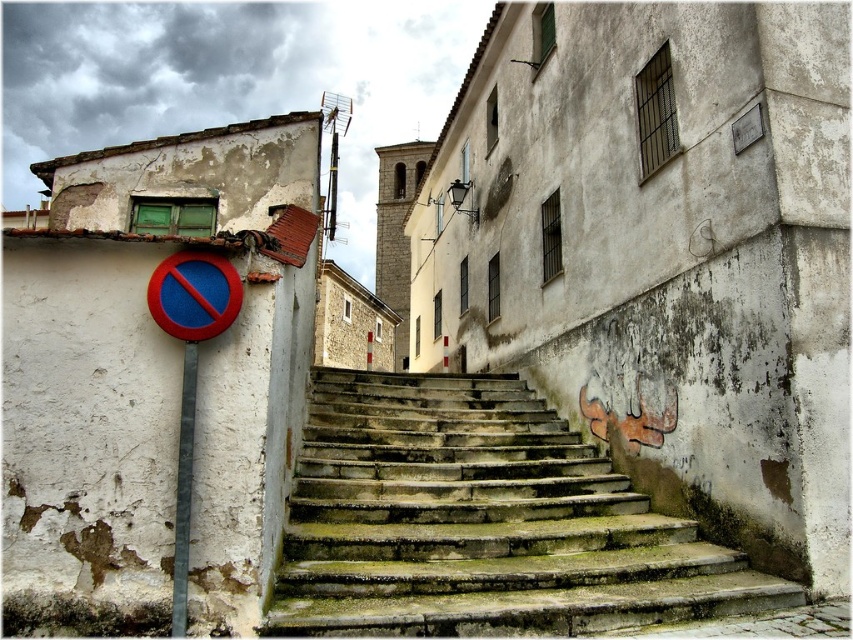
You are a painter who needs to reach the top of the gray metallic pole at left to fix a loose sign. You have a ladder that is the same height as the green mossy concrete stairs at center. Will your ladder be tall enough to reach the top?

The green mossy concrete stairs at center has a lesser height compared to the gray metallic pole at left. Since the ladder is the same height as the stairs, it will not be tall enough to reach the top of the pole.

You are a city planner assessing the space between the green mossy concrete stairs at center and the gray metallic pole at left. If you want to place a new bench here, which object would you need to consider in terms of size when ensuring there is enough space?

The green mossy concrete stairs at center is bigger than the gray metallic pole at left, so you would need to consider the size of the green mossy concrete stairs at center to ensure there is enough space for the bench.